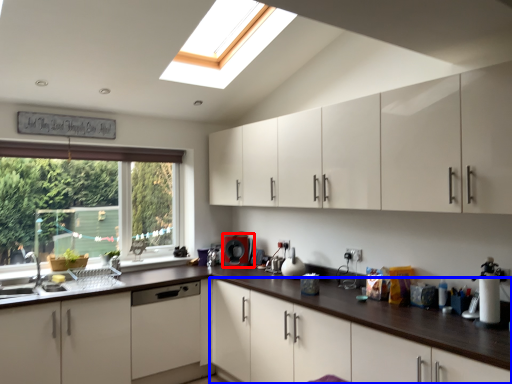
Question: Which object is further to the camera taking this photo, coffee machine (highlighted by a red box) or cabinetry (highlighted by a blue box)?

Choices:
 (A) coffee machine
 (B) cabinetry

Answer: (A)